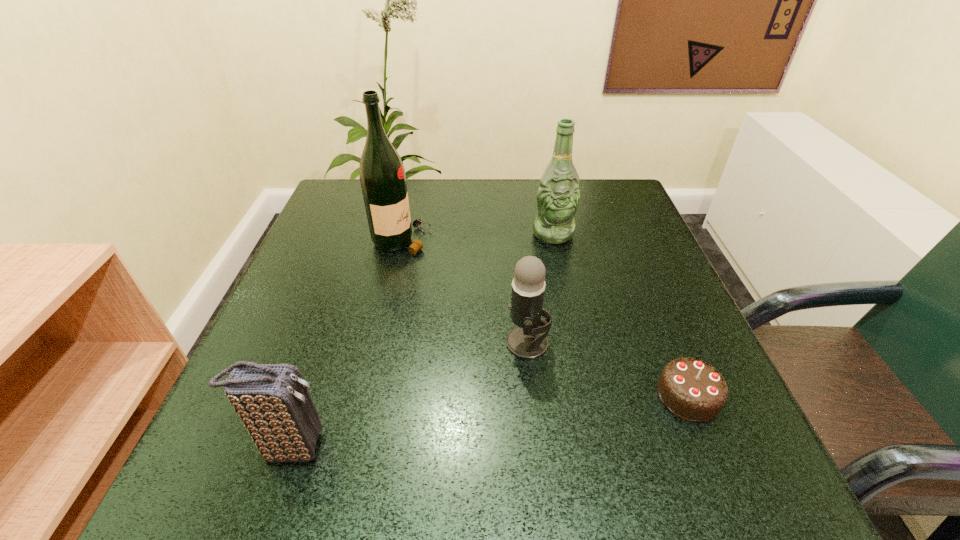
Identify the location of free space between the rightmost object and the clutch bag. The image size is (960, 540). (490, 421).

You are a GUI agent. You are given a task and a screenshot of the screen. Output one action in this format:
    pyautogui.click(x=<x>, y=<y>)
    Task: Click on the free spot between the shortest object and the second object from right to left
    This screenshot has height=540, width=960.
    Given the screenshot: What is the action you would take?
    pos(620,315)

Find the location of a particular element. free space between the third farthest object and the clutch bag is located at coordinates (409, 395).

The width and height of the screenshot is (960, 540). Find the location of `vacant space in between the nearest object and the chocolate cake`. vacant space in between the nearest object and the chocolate cake is located at coordinates (490, 421).

At what (x,y) coordinates should I click in order to perform the action: click on vacant area that lies between the second object from right to left and the wine bottle. Please return your answer as a coordinate pair (x, y). This screenshot has height=540, width=960. Looking at the image, I should click on (477, 237).

Select which object appears as the fourth closest to the shortest object. Please provide its 2D coordinates. Your answer should be formatted as a tuple, i.e. [(x, y)], where the tuple contains the x and y coordinates of a point satisfying the conditions above.

[(382, 175)]

Point out which object is positioned as the fourth nearest to the wine bottle. Please provide its 2D coordinates. Your answer should be formatted as a tuple, i.e. [(x, y)], where the tuple contains the x and y coordinates of a point satisfying the conditions above.

[(692, 389)]

The height and width of the screenshot is (540, 960). I want to click on free spot that satisfies the following two spatial constraints: 1. on the surface of the beer bottle; 2. on the surface of the tallest object, so pyautogui.click(x=554, y=240).

Identify the location of blank area in the image that satisfies the following two spatial constraints: 1. on the surface of the fourth object from left to right; 2. on the surface of the tallest object. This screenshot has height=540, width=960. (554, 240).

At what (x,y) coordinates should I click in order to perform the action: click on free space that satisfies the following two spatial constraints: 1. on the front side of the fourth farthest object; 2. with the zip open on the nearest object. Please return your answer as a coordinate pair (x, y). The height and width of the screenshot is (540, 960). Looking at the image, I should click on (709, 447).